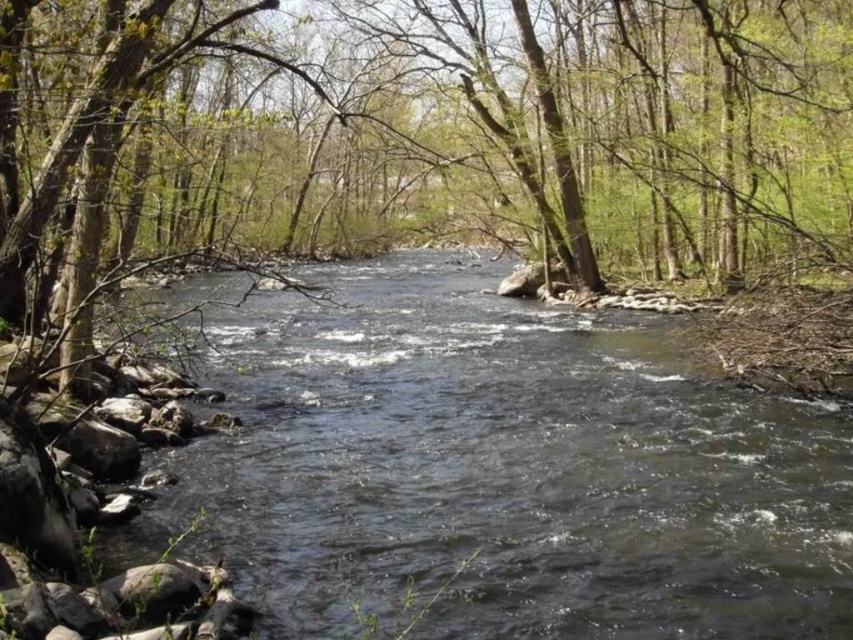
You are standing on the left bank of the river and want to cross to the right bank. There is a brown wood tree at center marked by point (448,148). Can you use this tree to help you cross the river?

The brown wood tree at center is located at point (448,148), which is in the middle of the river. You can use this tree as a midpoint to help cross the river safely.

You are a hiker trying to cross the river using the clear water stream at center. You notice a brown wood tree at center nearby. Which object is closer to you as you stand on the bank preparing to cross?

The brown wood tree at center is closer to you than the clear water stream at center because it is positioned further to the viewer.

You are planning to cross the river using a small raft that can only carry items up to 1 meter in width. Given the brown wood tree at center and the clear water stream at center, which object can the raft safely carry without exceeding its width limit?

The clear water stream at center can be safely carried by the raft since its width is narrower than the brown wood tree at center, which exceeds the 1 meter limit. However, the description only mentions the tree is wider than the stream, but doesn not specify exact measurements. Therefore, if the stream is under 1 meter, it would fit. Since the question states the raft can carry up to 1 meter, and the stream is narrower than the tree, assuming the tree is over 1m, the stream would be under and thus safe.